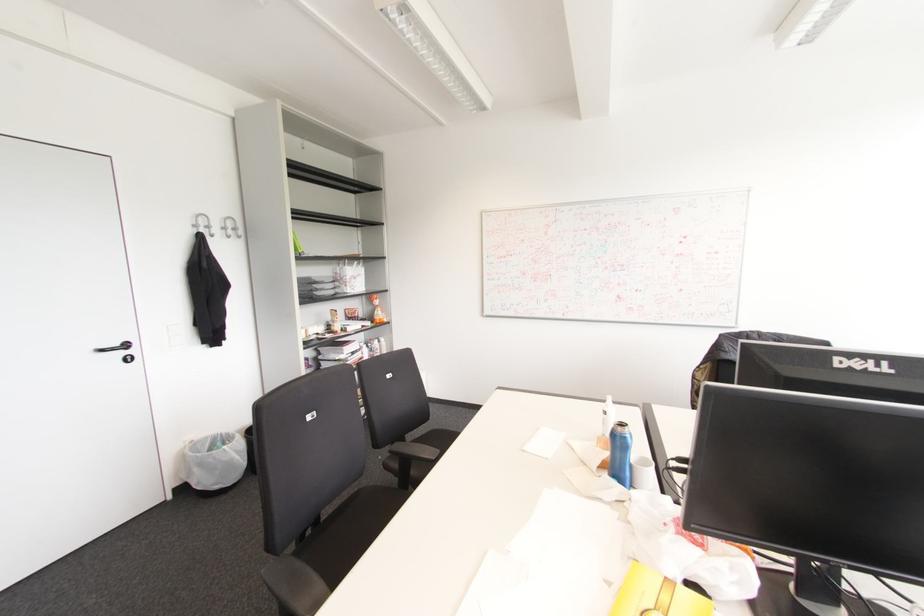
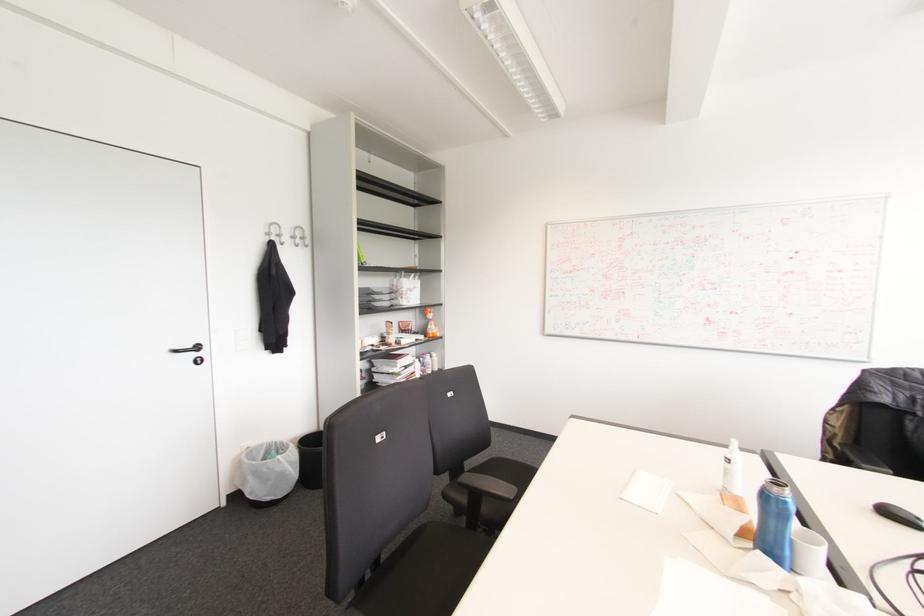
Locate, in the second image, the point that corresponds to (x=126, y=345) in the first image.

(197, 347)